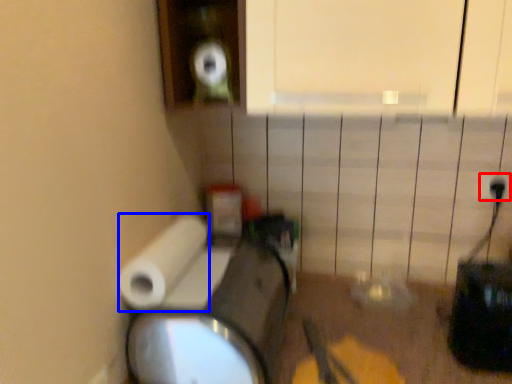
Question: Which object appears closest to the camera in this image, electric outlet (highlighted by a red box) or toilet paper (highlighted by a blue box)?

Choices:
 (A) electric outlet
 (B) toilet paper

Answer: (B)